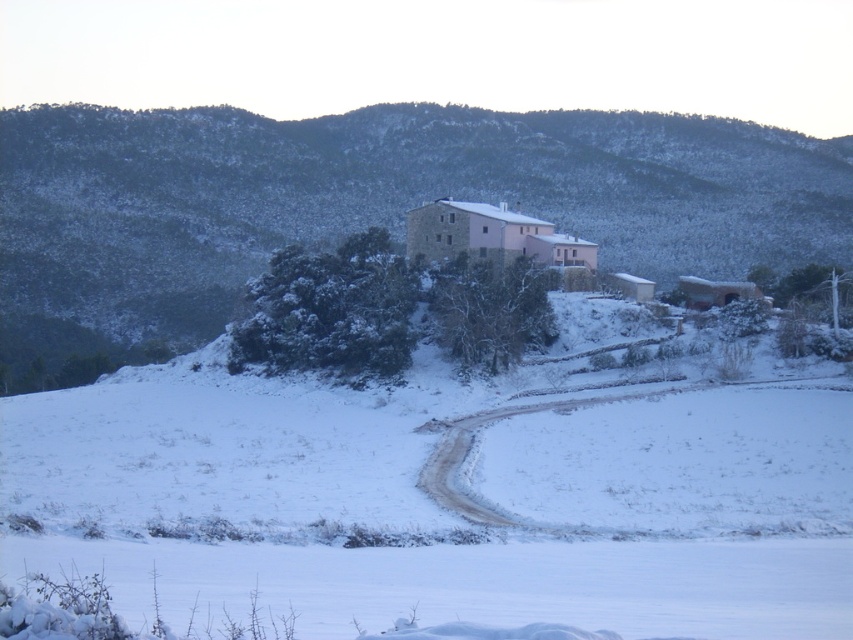
You are standing at the starting point of the dirt path in the winter landscape. You see two points marked on the path ahead of you. Which point is closer to you, point 1 at coordinates (215, 468) or point 2 at coordinates (201, 316)?

Point 1 at coordinates (215, 468) is closer to you than point 2 at coordinates (201, 316).